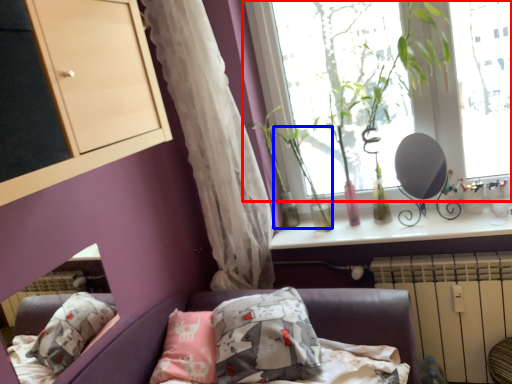
Question: Which object appears farthest to the camera in this image, window (highlighted by a red box) or plant (highlighted by a blue box)?

Choices:
 (A) window
 (B) plant

Answer: (B)